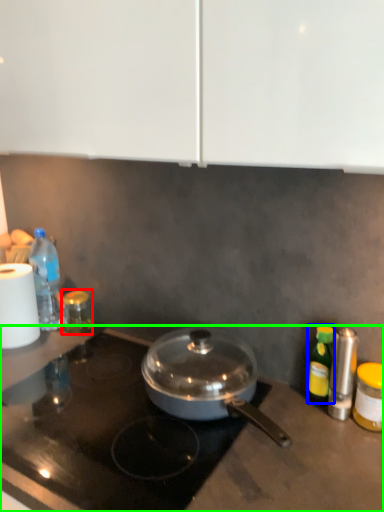
Question: Which object is positioned closest to bottle (highlighted by a red box)? Select from bottle (highlighted by a blue box) and gas stove (highlighted by a green box).

Choices:
 (A) bottle
 (B) gas stove

Answer: (B)